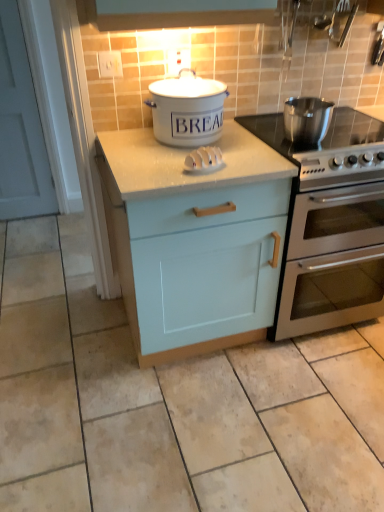
Describe the element at coordinates (194, 240) in the screenshot. This screenshot has width=384, height=512. I see `light blue wood cabinet at center` at that location.

What do you see at coordinates (330, 224) in the screenshot? I see `stainless steel oven at right` at bounding box center [330, 224].

Identify the location of white plastic knife block at center. (204, 160).

I want to click on white ceramic bread bin at center, acting as the 1th kitchen appliance starting from the left, so click(x=187, y=109).

Image resolution: width=384 pixels, height=512 pixels. Describe the element at coordinates (307, 119) in the screenshot. I see `polished stainless steel pot at right, the 1th kitchen appliance when ordered from right to left` at that location.

Where is `light blue wood cabinet at center`? This screenshot has height=512, width=384. light blue wood cabinet at center is located at coordinates (194, 240).

Locate an element on the screen. oven located below the polished stainless steel pot at right, the 1th kitchen appliance when ordered from right to left (from the image's perspective) is located at coordinates (330, 224).

Is stainless steel oven at right further to the viewer compared to polished stainless steel pot at right, acting as the second kitchen appliance starting from the left?

No, it is not.

Which of these two, stainless steel oven at right or polished stainless steel pot at right, acting as the second kitchen appliance starting from the left, stands shorter?

Standing shorter between the two is polished stainless steel pot at right, acting as the second kitchen appliance starting from the left.

Is white ceramic bread bin at center, acting as the 2th kitchen appliance starting from the right, in front of or behind stainless steel oven at right in the image?

In the image, white ceramic bread bin at center, acting as the 2th kitchen appliance starting from the right, appears in front of stainless steel oven at right.

Looking at this image, measure the distance from white ceramic bread bin at center, acting as the 1th kitchen appliance starting from the left, to stainless steel oven at right.

A distance of 54.16 centimeters exists between white ceramic bread bin at center, acting as the 1th kitchen appliance starting from the left, and stainless steel oven at right.

Looking at this image, does white ceramic bread bin at center, acting as the 2th kitchen appliance starting from the right, touch stainless steel oven at right?

No, white ceramic bread bin at center, acting as the 2th kitchen appliance starting from the right, is not beside stainless steel oven at right.

In terms of size, does white ceramic bread bin at center, acting as the 1th kitchen appliance starting from the left, appear bigger or smaller than stainless steel oven at right?

Clearly, white ceramic bread bin at center, acting as the 1th kitchen appliance starting from the left, is smaller in size than stainless steel oven at right.

At what (x,y) coordinates should I click in order to perform the action: click on appliance below the white ceramic bread bin at center, acting as the 1th kitchen appliance starting from the left (from the image's perspective). Please return your answer as a coordinate pair (x, y). Looking at the image, I should click on (204, 160).

Does white ceramic bread bin at center, acting as the 1th kitchen appliance starting from the left, have a smaller size compared to white plastic knife block at center?

Actually, white ceramic bread bin at center, acting as the 1th kitchen appliance starting from the left, might be larger than white plastic knife block at center.

Which point is more distant from viewer, (154, 95) or (209, 170)?

The point (154, 95) is farther.

Does white ceramic bread bin at center, acting as the 2th kitchen appliance starting from the right, appear on the left side of white plastic knife block at center?

Yes.

From the image's perspective, is polished stainless steel pot at right, the 1th kitchen appliance when ordered from right to left, on light blue wood cabinet at center?

Indeed, from the image's perspective, polished stainless steel pot at right, the 1th kitchen appliance when ordered from right to left, is shown above light blue wood cabinet at center.

Looking at the image, does polished stainless steel pot at right, the 1th kitchen appliance when ordered from right to left, seem bigger or smaller compared to light blue wood cabinet at center?

Considering their sizes, polished stainless steel pot at right, the 1th kitchen appliance when ordered from right to left, takes up less space than light blue wood cabinet at center.

Which is more to the right, polished stainless steel pot at right, acting as the second kitchen appliance starting from the left, or light blue wood cabinet at center?

From the viewer's perspective, polished stainless steel pot at right, acting as the second kitchen appliance starting from the left, appears more on the right side.

Looking at this image, can you confirm if white plastic knife block at center is positioned to the right of polished stainless steel pot at right, the 1th kitchen appliance when ordered from right to left?

No.

Who is shorter, white plastic knife block at center or polished stainless steel pot at right, acting as the second kitchen appliance starting from the left?

white plastic knife block at center is shorter.

From the image's perspective, is white plastic knife block at center beneath polished stainless steel pot at right, acting as the second kitchen appliance starting from the left?

Indeed, from the image's perspective, white plastic knife block at center is shown beneath polished stainless steel pot at right, acting as the second kitchen appliance starting from the left.

Consider the image. Which point is more distant from viewer, (218, 167) or (309, 116)?

Point (309, 116)

Is light blue wood cabinet at center inside the boundaries of polished stainless steel pot at right, the 1th kitchen appliance when ordered from right to left, or outside?

light blue wood cabinet at center is outside polished stainless steel pot at right, the 1th kitchen appliance when ordered from right to left.

From the picture: Between light blue wood cabinet at center and polished stainless steel pot at right, the 1th kitchen appliance when ordered from right to left, which one appears on the left side from the viewer's perspective?

From the viewer's perspective, light blue wood cabinet at center appears more on the left side.

From the image's perspective, does light blue wood cabinet at center appear higher than polished stainless steel pot at right, acting as the second kitchen appliance starting from the left?

No, from the image's perspective, light blue wood cabinet at center is not on top of polished stainless steel pot at right, acting as the second kitchen appliance starting from the left.

Where is `cabinetry below the polished stainless steel pot at right, the 1th kitchen appliance when ordered from right to left (from the image's perspective)`? cabinetry below the polished stainless steel pot at right, the 1th kitchen appliance when ordered from right to left (from the image's perspective) is located at coordinates (194, 240).

From a real-world perspective, is stainless steel gas stove at right on white ceramic bread bin at center, acting as the 2th kitchen appliance starting from the right?

Incorrect, from a real-world perspective, stainless steel gas stove at right is lower than white ceramic bread bin at center, acting as the 2th kitchen appliance starting from the right.

Between stainless steel gas stove at right and white ceramic bread bin at center, acting as the 2th kitchen appliance starting from the right, which one has smaller width?

white ceramic bread bin at center, acting as the 2th kitchen appliance starting from the right.

From the image's perspective, starting from the stainless steel gas stove at right, which kitchen appliance is the 2nd one above? Please provide its 2D coordinates.

[(187, 109)]

Looking at the image, does stainless steel gas stove at right seem bigger or smaller compared to white ceramic bread bin at center, acting as the 2th kitchen appliance starting from the right?

stainless steel gas stove at right is bigger than white ceramic bread bin at center, acting as the 2th kitchen appliance starting from the right.

Locate an element on the screen. the 1st kitchen appliance positioned above the stainless steel oven at right (from a real-world perspective) is located at coordinates (x=307, y=119).

Find the location of a particular element. Image resolution: width=384 pixels, height=512 pixels. oven on the right of white ceramic bread bin at center, acting as the 1th kitchen appliance starting from the left is located at coordinates (330, 224).

Estimate the real-world distances between objects in this image. Which object is further from stainless steel gas stove at right, white ceramic bread bin at center, acting as the 2th kitchen appliance starting from the right, or polished stainless steel pot at right, the 1th kitchen appliance when ordered from right to left?

white ceramic bread bin at center, acting as the 2th kitchen appliance starting from the right, lies further to stainless steel gas stove at right than the other object.

Which object lies further to the anchor point white plastic knife block at center, light blue wood cabinet at center or polished stainless steel pot at right, the 1th kitchen appliance when ordered from right to left?

polished stainless steel pot at right, the 1th kitchen appliance when ordered from right to left.

Looking at the image, which one is located closer to white plastic knife block at center, polished stainless steel pot at right, acting as the second kitchen appliance starting from the left, or stainless steel oven at right?

Based on the image, polished stainless steel pot at right, acting as the second kitchen appliance starting from the left, appears to be nearer to white plastic knife block at center.

Which object lies further to the anchor point stainless steel oven at right, polished stainless steel pot at right, the 1th kitchen appliance when ordered from right to left, or white ceramic bread bin at center, acting as the 2th kitchen appliance starting from the right?

white ceramic bread bin at center, acting as the 2th kitchen appliance starting from the right, lies further to stainless steel oven at right than the other object.

Which object lies further to the anchor point polished stainless steel pot at right, the 1th kitchen appliance when ordered from right to left, stainless steel gas stove at right or white ceramic bread bin at center, acting as the 2th kitchen appliance starting from the right?

Among the two, white ceramic bread bin at center, acting as the 2th kitchen appliance starting from the right, is located further to polished stainless steel pot at right, the 1th kitchen appliance when ordered from right to left.

From the image, which object appears to be farther from polished stainless steel pot at right, acting as the second kitchen appliance starting from the left, stainless steel oven at right or stainless steel gas stove at right?

Among the two, stainless steel oven at right is located further to polished stainless steel pot at right, acting as the second kitchen appliance starting from the left.

When comparing their distances from polished stainless steel pot at right, the 1th kitchen appliance when ordered from right to left, does white ceramic bread bin at center, acting as the 1th kitchen appliance starting from the left, or light blue wood cabinet at center seem further?

Based on the image, light blue wood cabinet at center appears to be further to polished stainless steel pot at right, the 1th kitchen appliance when ordered from right to left.

Estimate the real-world distances between objects in this image. Which object is further from white plastic knife block at center, stainless steel oven at right or polished stainless steel pot at right, the 1th kitchen appliance when ordered from right to left?

stainless steel oven at right is further to white plastic knife block at center.

The image size is (384, 512). In order to click on gas stove between white plastic knife block at center and stainless steel oven at right in the horizontal direction in this screenshot , I will do `click(325, 136)`.

The image size is (384, 512). What are the coordinates of `kitchen appliance between white ceramic bread bin at center, acting as the 1th kitchen appliance starting from the left, and stainless steel gas stove at right from left to right` in the screenshot? It's located at (307, 119).

Find the location of a particular element. kitchen appliance located between white plastic knife block at center and stainless steel oven at right in the left-right direction is located at coordinates (307, 119).

Locate an element on the screen. This screenshot has width=384, height=512. gas stove between polished stainless steel pot at right, the 1th kitchen appliance when ordered from right to left, and stainless steel oven at right in the up-down direction is located at coordinates (325, 136).